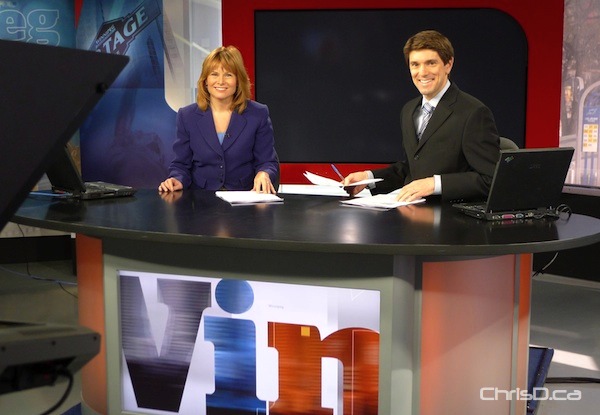
The image size is (600, 415). In order to click on desk in this screenshot , I will do `click(487, 325)`.